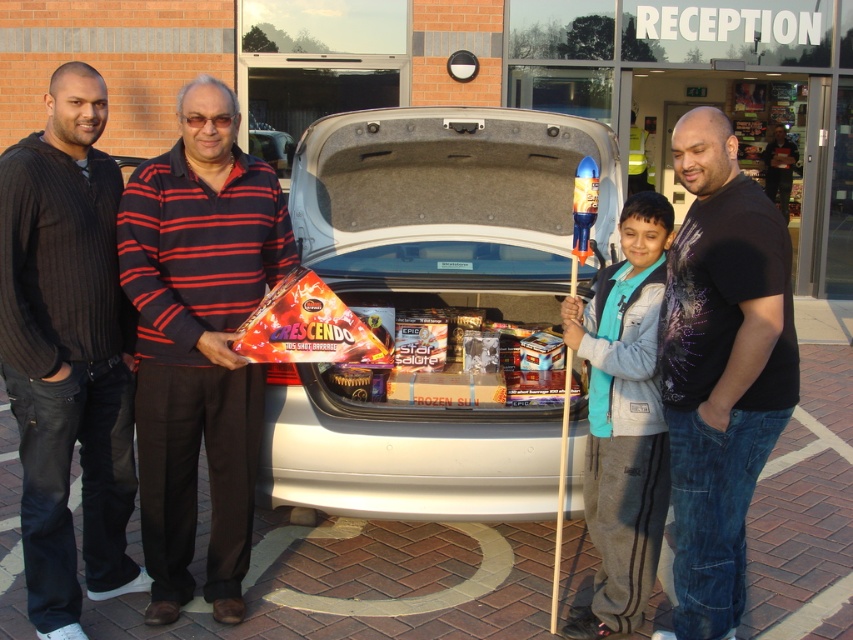
Question: Does silver metallic car trunk at center have a lesser width compared to striped sweater at center?

Choices:
 (A) yes
 (B) no

Answer: (B)

Question: Which point is farther from the camera taking this photo?

Choices:
 (A) (209, 484)
 (B) (680, 513)

Answer: (A)

Question: Is striped sweater at center to the left of black t-shirt at center from the viewer's perspective?

Choices:
 (A) no
 (B) yes

Answer: (B)

Question: Which of the following is the closest to the observer?

Choices:
 (A) (734, 212)
 (B) (202, 337)
 (C) (300, 147)
 (D) (4, 250)

Answer: (A)

Question: Which object appears farthest from the camera in this image?

Choices:
 (A) striped sweater at center
 (B) dark brown sweater at left
 (C) silver metallic car trunk at center
 (D) black t-shirt at center

Answer: (C)

Question: Can you confirm if striped sweater at center is positioned below black t-shirt at center?

Choices:
 (A) no
 (B) yes

Answer: (A)